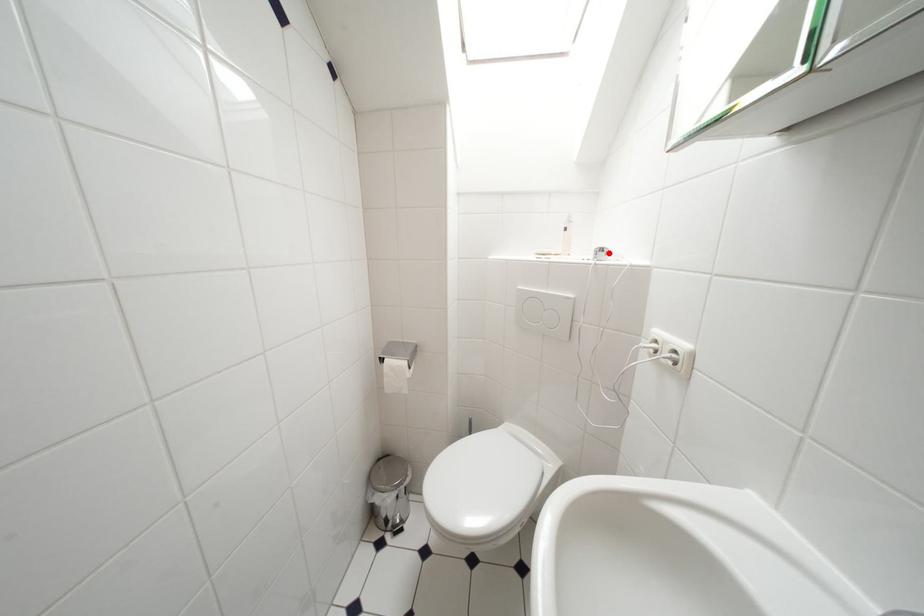
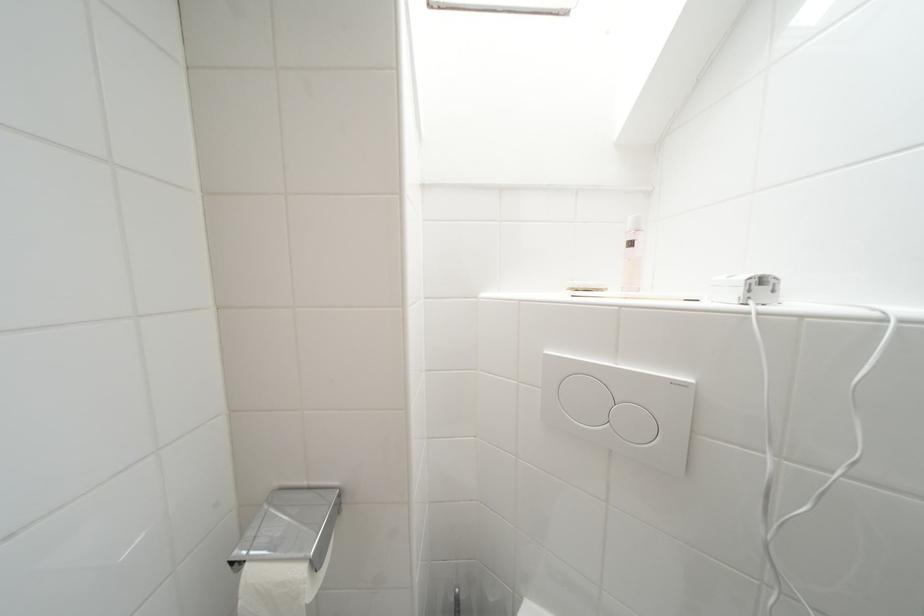
The point at the highlighted location is marked in the first image. Where is the corresponding point in the second image?

(769, 283)